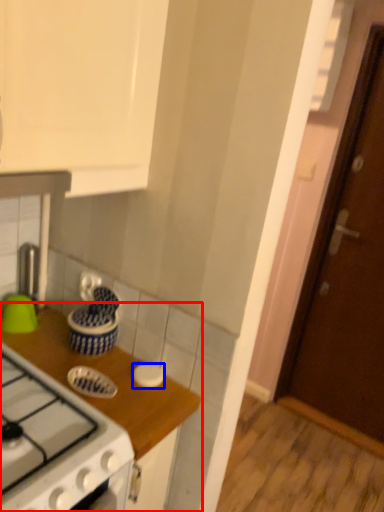
Question: Which object is closer to the camera taking this photo, countertop (highlighted by a red box) or kitchen appliance (highlighted by a blue box)?

Choices:
 (A) countertop
 (B) kitchen appliance

Answer: (A)